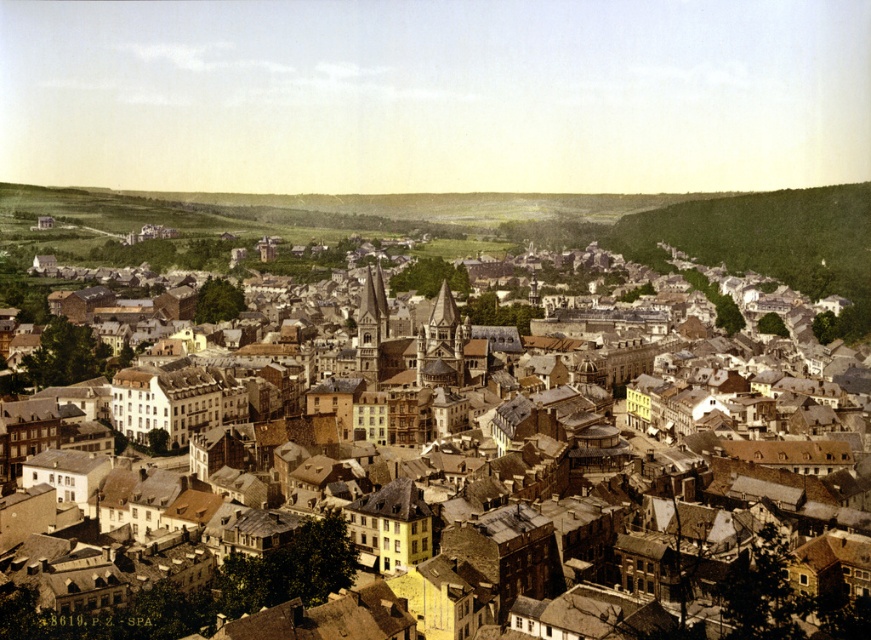
Which is more to the left, brown stone buildings at center or green grassy hillside at upper right?

From the viewer's perspective, brown stone buildings at center appears more on the left side.

Does brown stone buildings at center appear under green grassy hillside at upper right?

Yes.

Is point (145, 612) closer to camera compared to point (684, 211)?

Yes, point (145, 612) is in front of point (684, 211).

Where is `brown stone buildings at center`? This screenshot has width=871, height=640. brown stone buildings at center is located at coordinates (199, 593).